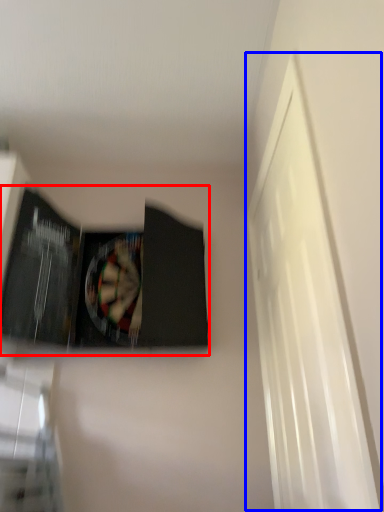
Question: Which point is further to the camera, paperback book (highlighted by a red box) or window (highlighted by a blue box)?

Choices:
 (A) paperback book
 (B) window

Answer: (A)